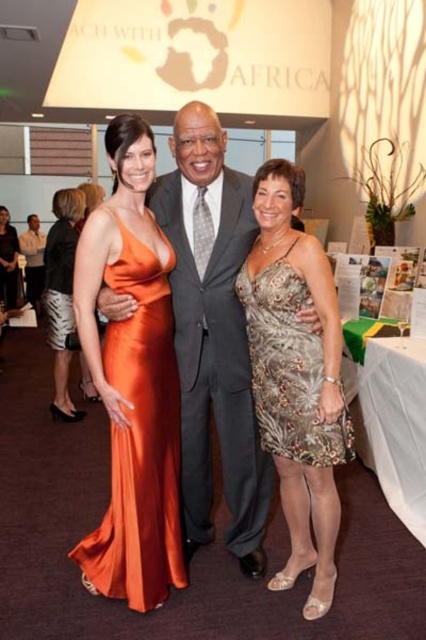
Question: Is satin orange dress at center smaller than silver sequined dress at center?

Choices:
 (A) yes
 (B) no

Answer: (B)

Question: Does silver sequined dress at center have a lesser width compared to matte gray suit at center?

Choices:
 (A) yes
 (B) no

Answer: (A)

Question: Is satin dress at center further to camera compared to silver sequined dress at center?

Choices:
 (A) yes
 (B) no

Answer: (A)

Question: Which object is farther from the camera taking this photo?

Choices:
 (A) orange satin dress at left
 (B) satin dress at center
 (C) silver sequined dress at center

Answer: (A)

Question: Which of the following is the farthest from the observer?

Choices:
 (A) (181, 285)
 (B) (175, 577)

Answer: (A)

Question: Which point is closer to the camera taking this photo?

Choices:
 (A) (103, 346)
 (B) (66, 234)
 (C) (279, 404)

Answer: (C)